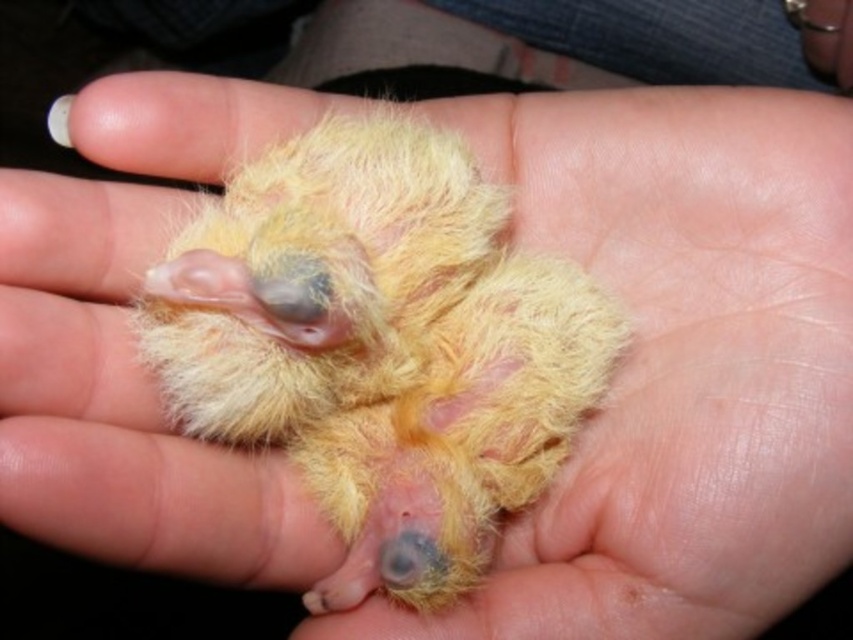
Based on the photo, who is shorter, fluffy yellow bird at center or yellow downy feather at center?

Standing shorter between the two is yellow downy feather at center.

Can you confirm if fluffy yellow bird at center is thinner than yellow downy feather at center?

No, fluffy yellow bird at center is not thinner than yellow downy feather at center.

Is point (479, 394) more distant than point (50, 120)?

Yes, it is.

Where is `fluffy yellow bird at center`? fluffy yellow bird at center is located at coordinates (381, 346).